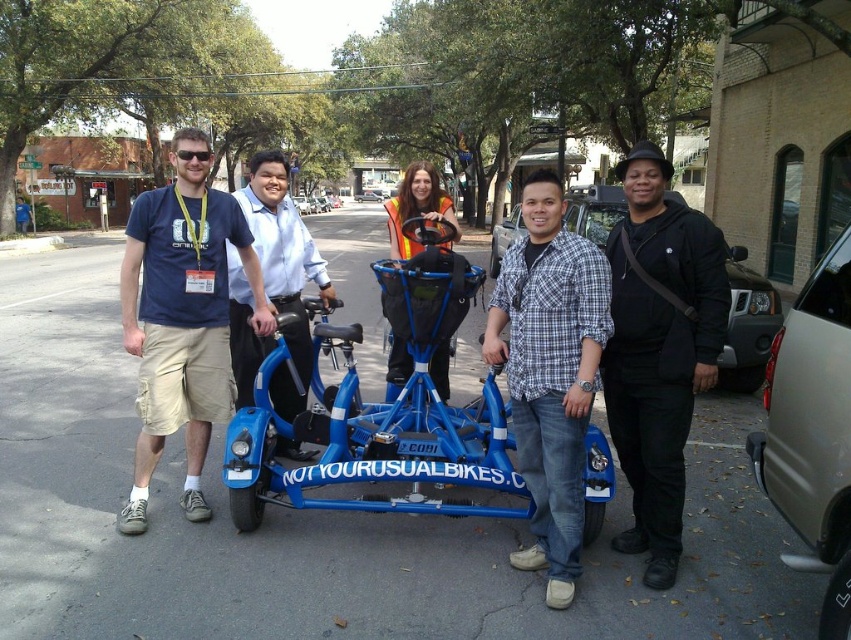
Which is behind, point (181, 262) or point (803, 468)?

Positioned behind is point (181, 262).

Is matte blue shorts at left to the right of metallic gray sedan at lower right from the viewer's perspective?

Incorrect, matte blue shorts at left is not on the right side of metallic gray sedan at lower right.

Does point (163, 257) come farther from viewer compared to point (790, 515)?

Yes, it is behind point (790, 515).

This screenshot has height=640, width=851. What are the coordinates of `matte blue shorts at left` in the screenshot? It's located at (181, 317).

Can you confirm if metallic gray sedan at lower right is positioned to the right of black matte car at right?

Incorrect, metallic gray sedan at lower right is not on the right side of black matte car at right.

Which is behind, point (838, 467) or point (723, 355)?

The point (723, 355) is behind.

Which is in front, point (780, 483) or point (598, 212)?

Point (780, 483) is in front.

Image resolution: width=851 pixels, height=640 pixels. Identify the location of metallic gray sedan at lower right. (812, 429).

Does plaid shirt at center have a lesser width compared to black matte car at right?

Indeed, plaid shirt at center has a lesser width compared to black matte car at right.

Identify the location of plaid shirt at center. (550, 372).

Locate an element on the screen. This screenshot has height=640, width=851. plaid shirt at center is located at coordinates (550, 372).